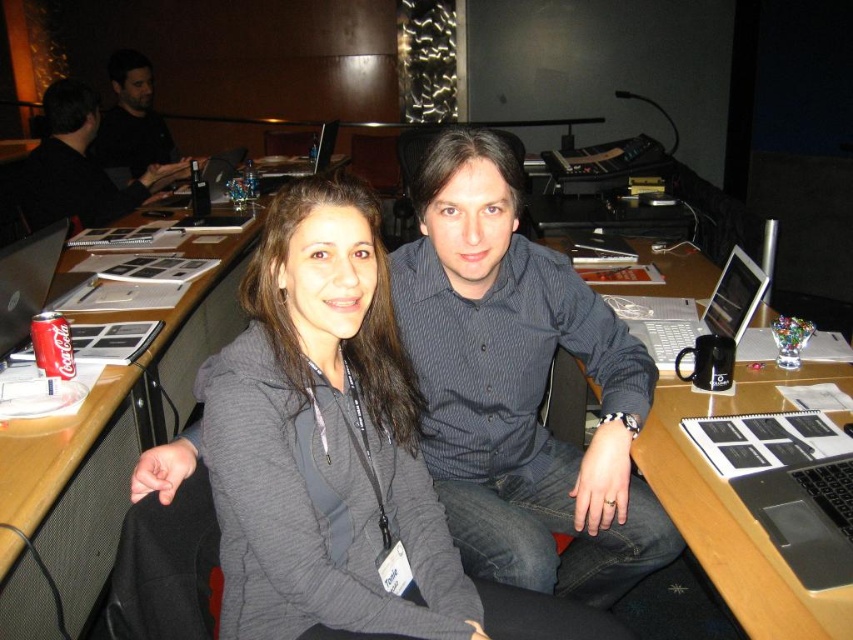
You are standing in the room and see two points marked in the image. Which point is closer to you, point (660, 365) or point (49, 358)?

Point (660, 365) is further to the viewer than point (49, 358), so point (49, 358) is closer to you.